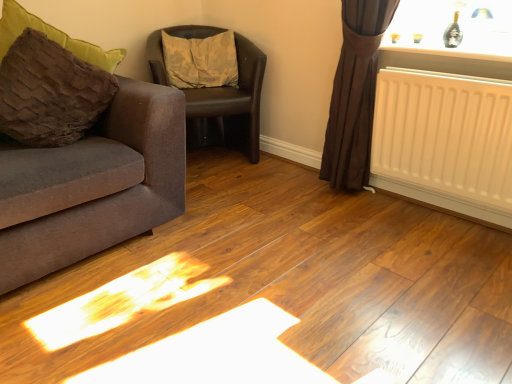
Question: Can you confirm if brown leather chair at center is thinner than brown fuzzy pillow at left, which ranks as the second pillow in right-to-left order?

Choices:
 (A) no
 (B) yes

Answer: (A)

Question: Considering the relative sizes of brown leather chair at center and brown fuzzy pillow at left, which ranks as the second pillow in right-to-left order, in the image provided, is brown leather chair at center shorter than brown fuzzy pillow at left, which ranks as the second pillow in right-to-left order,?

Choices:
 (A) no
 (B) yes

Answer: (A)

Question: Does brown leather chair at center come in front of brown fuzzy pillow at left, which ranks as the second pillow in right-to-left order?

Choices:
 (A) no
 (B) yes

Answer: (A)

Question: From the image's perspective, does brown leather chair at center appear lower than brown fuzzy pillow at left, the first pillow in the left-to-right sequence?

Choices:
 (A) no
 (B) yes

Answer: (A)

Question: From the image's perspective, is brown leather chair at center over brown fuzzy pillow at left, which ranks as the second pillow in right-to-left order?

Choices:
 (A) yes
 (B) no

Answer: (A)

Question: Is white matte radiator at right wider or thinner than white plastic radiator at upper right?

Choices:
 (A) wide
 (B) thin

Answer: (B)

Question: Is white matte radiator at right inside or outside of white plastic radiator at upper right?

Choices:
 (A) outside
 (B) inside

Answer: (A)

Question: In the image, is white matte radiator at right positioned in front of or behind white plastic radiator at upper right?

Choices:
 (A) front
 (B) behind

Answer: (A)

Question: From the image's perspective, is white matte radiator at right located above or below white plastic radiator at upper right?

Choices:
 (A) above
 (B) below

Answer: (B)

Question: From a real-world perspective, relative to brown leather chair at center, is camouflage fabric pillow at center, positioned as the 2th pillow in left-to-right order, vertically above or below?

Choices:
 (A) below
 (B) above

Answer: (B)

Question: From the image's perspective, is camouflage fabric pillow at center, positioned as the 2th pillow in left-to-right order, positioned above or below brown leather chair at center?

Choices:
 (A) below
 (B) above

Answer: (B)

Question: Is camouflage fabric pillow at center, positioned as the 2th pillow in left-to-right order, wider or thinner than brown leather chair at center?

Choices:
 (A) thin
 (B) wide

Answer: (A)

Question: Based on their sizes in the image, would you say camouflage fabric pillow at center, which is the first pillow from right to left, is bigger or smaller than brown leather chair at center?

Choices:
 (A) small
 (B) big

Answer: (A)

Question: Looking at the image, does white plastic radiator at upper right seem bigger or smaller compared to brown leather chair at center?

Choices:
 (A) small
 (B) big

Answer: (A)

Question: Is white plastic radiator at upper right spatially inside brown leather chair at center, or outside of it?

Choices:
 (A) inside
 (B) outside

Answer: (B)